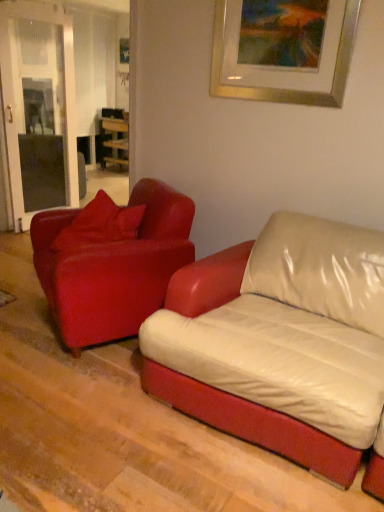
Question: Can matte red leather couch at left, which ranks as the 2th studio couch in left-to-right order, be found inside gold metallic picture frame at upper center?

Choices:
 (A) no
 (B) yes

Answer: (A)

Question: Can you confirm if gold metallic picture frame at upper center is positioned to the left of matte red leather couch at left, positioned as the first studio couch in right-to-left order?

Choices:
 (A) yes
 (B) no

Answer: (B)

Question: Are gold metallic picture frame at upper center and matte red leather couch at left, which ranks as the 2th studio couch in left-to-right order, making contact?

Choices:
 (A) no
 (B) yes

Answer: (A)

Question: Is the position of gold metallic picture frame at upper center more distant than that of matte red leather couch at left, which ranks as the 2th studio couch in left-to-right order?

Choices:
 (A) yes
 (B) no

Answer: (B)

Question: Is gold metallic picture frame at upper center aimed at matte red leather couch at left, positioned as the first studio couch in right-to-left order?

Choices:
 (A) yes
 (B) no

Answer: (B)

Question: Based on their positions, is matte red leather couch at left, positioned as the first studio couch in right-to-left order, located to the left or right of gold metallic picture frame at upper center?

Choices:
 (A) left
 (B) right

Answer: (A)

Question: Is point (117, 302) positioned closer to the camera than point (276, 96)?

Choices:
 (A) farther
 (B) closer

Answer: (A)

Question: Is matte red leather couch at left, positioned as the first studio couch in right-to-left order, wider or thinner than gold metallic picture frame at upper center?

Choices:
 (A) thin
 (B) wide

Answer: (B)

Question: Is matte red leather couch at left, which ranks as the 2th studio couch in left-to-right order, inside the boundaries of gold metallic picture frame at upper center, or outside?

Choices:
 (A) outside
 (B) inside

Answer: (A)

Question: Is wooden table at center wider or thinner than gold metallic picture frame at upper center?

Choices:
 (A) thin
 (B) wide

Answer: (B)

Question: In terms of size, does wooden table at center appear bigger or smaller than gold metallic picture frame at upper center?

Choices:
 (A) big
 (B) small

Answer: (A)

Question: Considering the positions of point (110, 141) and point (354, 10), is point (110, 141) closer or farther from the camera than point (354, 10)?

Choices:
 (A) closer
 (B) farther

Answer: (B)

Question: Considering the positions of wooden table at center and gold metallic picture frame at upper center in the image, is wooden table at center taller or shorter than gold metallic picture frame at upper center?

Choices:
 (A) short
 (B) tall

Answer: (B)

Question: Looking at the image, does matte red pillow at left seem bigger or smaller compared to gold metallic picture frame at upper center?

Choices:
 (A) big
 (B) small

Answer: (A)

Question: From a real-world perspective, is matte red pillow at left above or below gold metallic picture frame at upper center?

Choices:
 (A) above
 (B) below

Answer: (B)